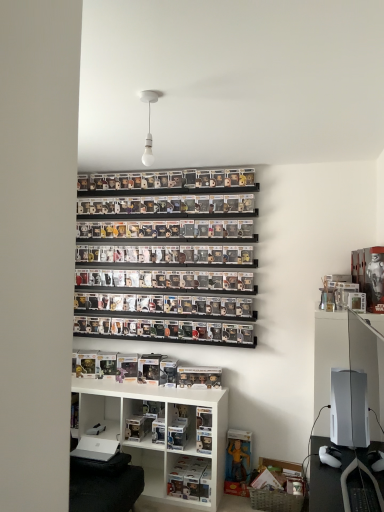
Identify the location of empty space that is ontop of clear plastic figures at center, which is the 1th shelf from top to bottom (from a real-world perspective). The width and height of the screenshot is (384, 512). (158, 333).